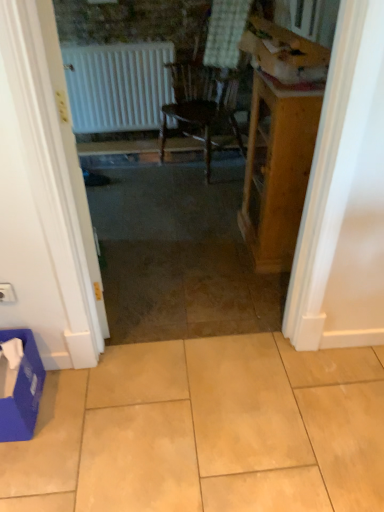
Question: Would you say white plastic electric outlet at lower left is to the left or to the right of blue cardboard box at lower left, which is the 2th cardboard box in top-to-bottom order, in the picture?

Choices:
 (A) right
 (B) left

Answer: (B)

Question: Is white plastic electric outlet at lower left bigger or smaller than blue cardboard box at lower left, which ranks as the second cardboard box in right-to-left order?

Choices:
 (A) big
 (B) small

Answer: (B)

Question: Based on their relative distances, which object is nearer to the white matte door at left?

Choices:
 (A) wooden table at right
 (B) white matte radiator at upper left
 (C) cardboard box at upper right, the second cardboard box ordered from the bottom
 (D) blue cardboard box at lower left, which ranks as the second cardboard box in right-to-left order
 (E) beige ceramic tile at center

Answer: (D)

Question: Which object is the closest to the wooden table at right?

Choices:
 (A) cardboard box at upper right, positioned as the first cardboard box in top-to-bottom order
 (B) white matte door at left
 (C) white matte radiator at upper left
 (D) white plastic electric outlet at lower left
 (E) beige ceramic tile at center

Answer: (A)